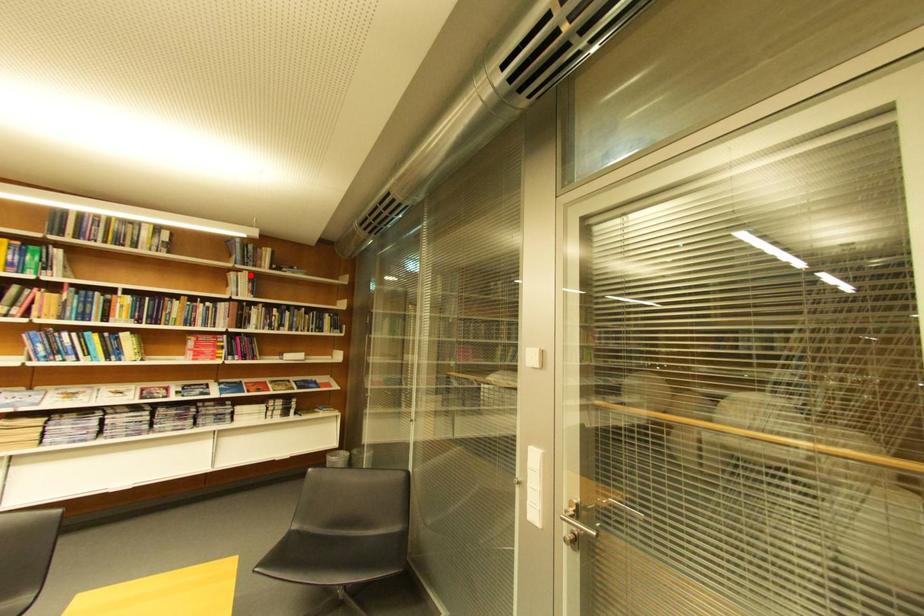
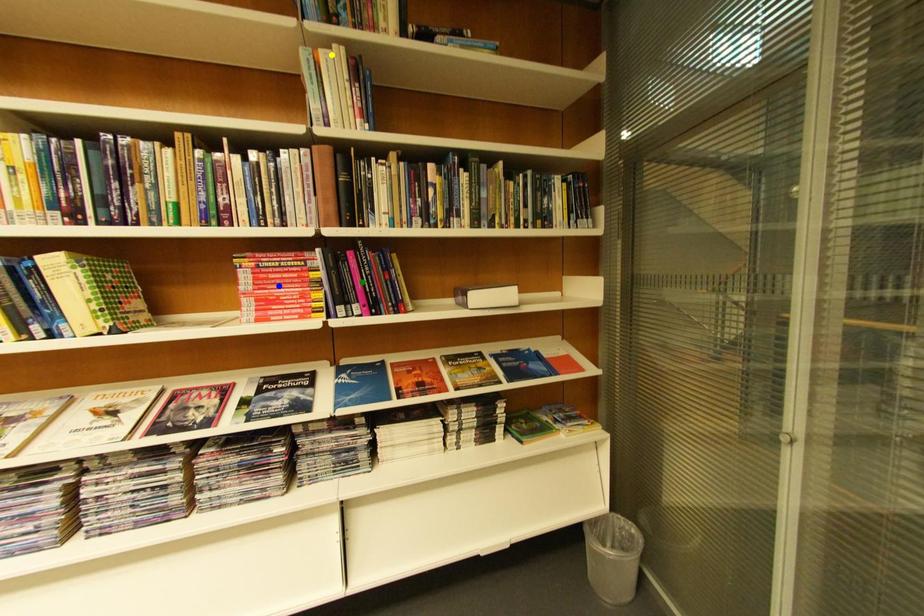
Question: I am providing you with two images of the same scene from different viewpoints. A red point is marked on the first image. You are given multiple points on the second image. Can you choose the point in image 2 that corresponds to the point in image 1?

Choices:
 (A) yellow point
 (B) blue point
 (C) green point

Answer: (A)